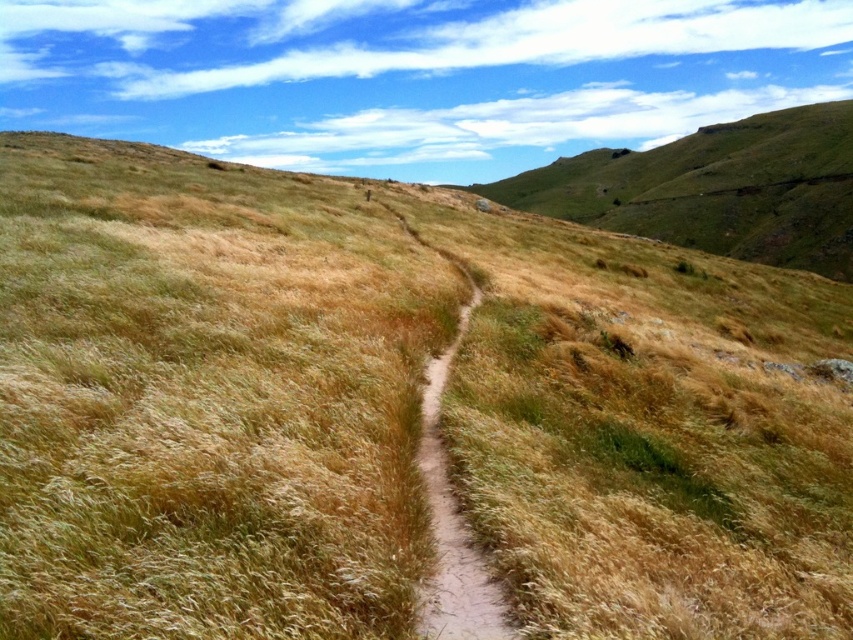
Who is lower down, green grassy hillside at upper right or brown dirt path at center?

Positioned lower is brown dirt path at center.

Which is above, green grassy hillside at upper right or brown dirt path at center?

Positioned higher is green grassy hillside at upper right.

Find the location of `green grassy hillside at upper right`. green grassy hillside at upper right is located at coordinates (715, 189).